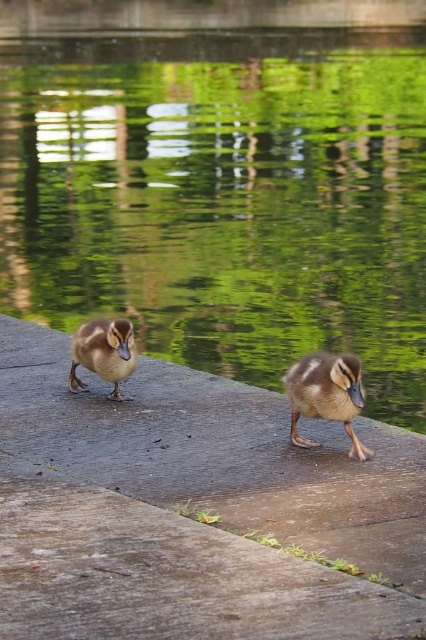
Question: Can you confirm if brown concrete ledge at center is positioned to the right of brown matte duckling at center?

Choices:
 (A) yes
 (B) no

Answer: (B)

Question: Does brown concrete ledge at center have a smaller size compared to brown fuzzy duckling at center?

Choices:
 (A) no
 (B) yes

Answer: (A)

Question: Among these points, which one is nearest to the camera?

Choices:
 (A) (123, 349)
 (B) (178, 166)

Answer: (A)

Question: Is green reflective water at center closer to camera compared to brown fuzzy duckling at center?

Choices:
 (A) no
 (B) yes

Answer: (B)

Question: Among these points, which one is nearest to the camera?

Choices:
 (A) (74, 364)
 (B) (353, 369)
 (C) (273, 150)

Answer: (B)

Question: Among these objects, which one is farthest from the camera?

Choices:
 (A) brown concrete ledge at center
 (B) brown matte duckling at center
 (C) brown fuzzy duckling at center
 (D) green reflective water at center

Answer: (C)